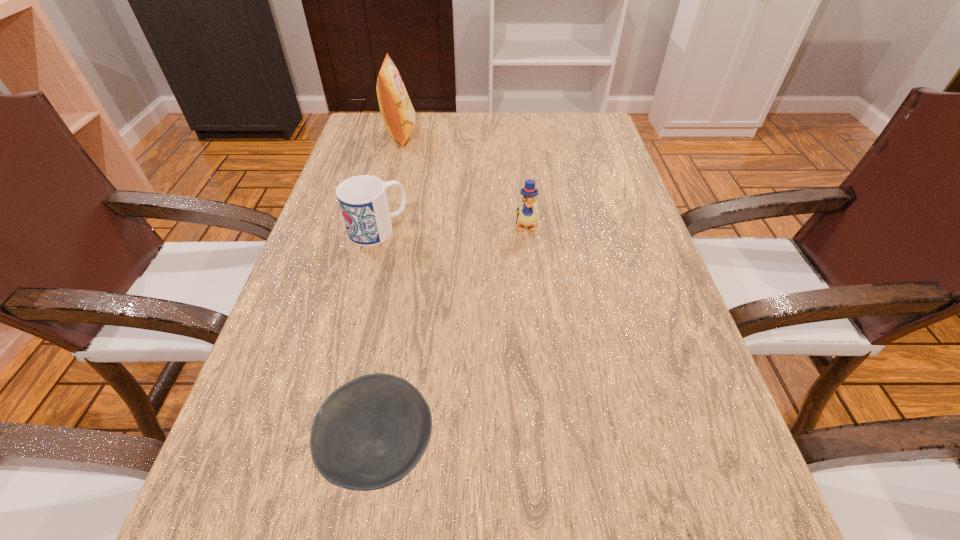
Locate an element on the screen. The height and width of the screenshot is (540, 960). vacant region that satisfies the following two spatial constraints: 1. on the front-facing side of the farthest object; 2. on the back side of the nearest object is located at coordinates (322, 448).

The image size is (960, 540). I want to click on free spot that satisfies the following two spatial constraints: 1. on the front-facing side of the crisp (potato chip); 2. on the back side of the shortest object, so click(x=322, y=448).

This screenshot has height=540, width=960. Identify the location of free location that satisfies the following two spatial constraints: 1. on the front-facing side of the tallest object; 2. on the back side of the mug. (377, 230).

Locate an element on the screen. The image size is (960, 540). vacant area that satisfies the following two spatial constraints: 1. on the front-facing side of the shortest object; 2. on the left side of the farthest object is located at coordinates (322, 448).

Identify the location of vacant space that satisfies the following two spatial constraints: 1. on the front-facing side of the farthest object; 2. on the right side of the bowl. (322, 448).